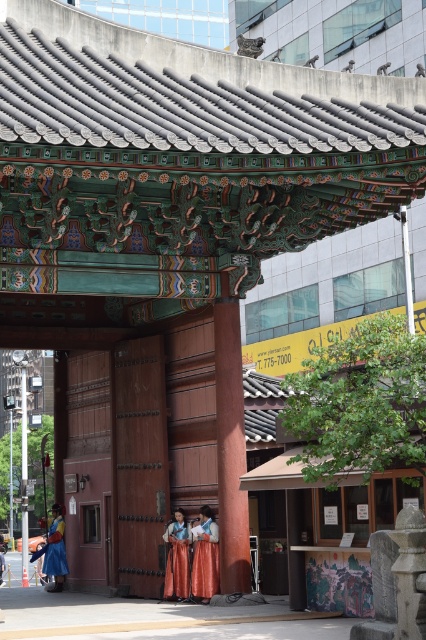
Question: Observing the image, what is the correct spatial positioning of orange silk dress at center in reference to silk orange dress at center?

Choices:
 (A) left
 (B) right

Answer: (B)

Question: Observing the image, what is the correct spatial positioning of orange silk dress at center in reference to matte blue robe at lower left?

Choices:
 (A) below
 (B) above

Answer: (B)

Question: Which point is farther to the camera?

Choices:
 (A) (48, 570)
 (B) (169, 564)
 (C) (210, 573)

Answer: (A)

Question: Which object is positioned closest to the matte blue robe at lower left?

Choices:
 (A) silk orange dress at center
 (B) orange silk dress at center

Answer: (A)

Question: Which of the following is the closest to the observer?

Choices:
 (A) orange silk dress at center
 (B) silk orange dress at center
 (C) matte blue robe at lower left

Answer: (A)

Question: Does orange silk dress at center appear over matte blue robe at lower left?

Choices:
 (A) yes
 (B) no

Answer: (A)